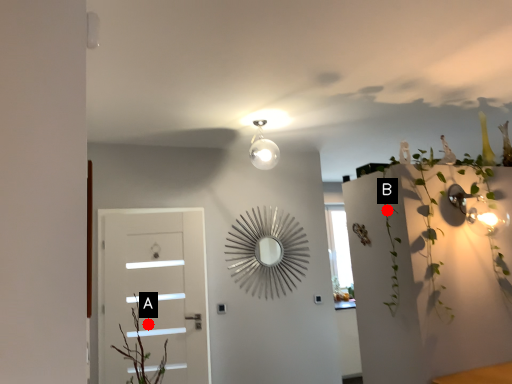
Question: Two points are circled on the image, labeled by A and B beside each circle. Which point appears closest to the camera in this image?

Choices:
 (A) A is closer
 (B) B is closer

Answer: (B)